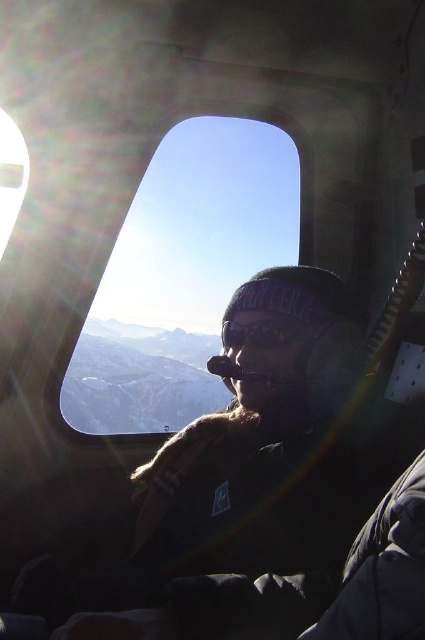
Question: Can you confirm if transparent glass window at center is thinner than matte black goggles at center?

Choices:
 (A) no
 (B) yes

Answer: (A)

Question: Among these points, which one is farthest from the camera?

Choices:
 (A) (271, 321)
 (B) (101, 422)

Answer: (B)

Question: Is transparent glass window at center closer to the viewer compared to matte black goggles at center?

Choices:
 (A) no
 (B) yes

Answer: (A)

Question: Does transparent glass window at center have a lesser width compared to matte black goggles at center?

Choices:
 (A) yes
 (B) no

Answer: (B)